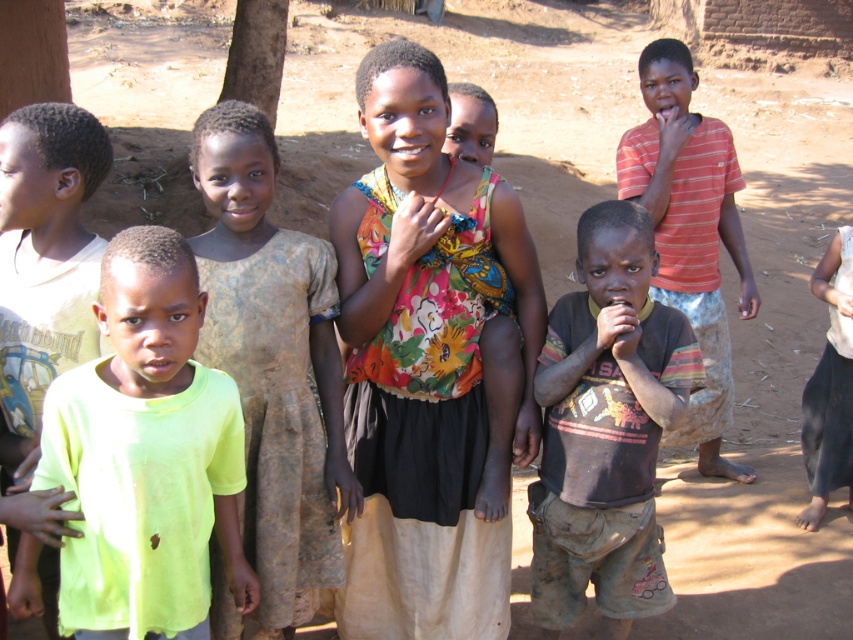
Can you confirm if neon yellow t-shirt at left is thinner than dirty brown shirt at center?

In fact, neon yellow t-shirt at left might be wider than dirty brown shirt at center.

How far apart are neon yellow t-shirt at left and dirty brown shirt at center?

The distance of neon yellow t-shirt at left from dirty brown shirt at center is 3.88 feet.

I want to click on neon yellow t-shirt at left, so click(x=157, y=451).

Locate an element on the screen. Image resolution: width=853 pixels, height=640 pixels. neon yellow t-shirt at left is located at coordinates (157, 451).

Between point (39, 161) and point (714, 248), which one is positioned in front?

Point (39, 161)

Is light green t-shirt at left below striped cotton shirt at right?

Yes, light green t-shirt at left is below striped cotton shirt at right.

Does point (18, 244) lie in front of point (747, 269)?

Yes.

Find the location of `light green t-shirt at left`. light green t-shirt at left is located at coordinates (44, 262).

Which is below, neon yellow t-shirt at left or striped cotton shirt at right?

neon yellow t-shirt at left is below.

Does neon yellow t-shirt at left have a larger size compared to striped cotton shirt at right?

No.

You are a GUI agent. You are given a task and a screenshot of the screen. Output one action in this format:
    pyautogui.click(x=<x>, y=<y>)
    Task: Click on the neon yellow t-shirt at left
    
    Given the screenshot: What is the action you would take?
    pyautogui.click(x=157, y=451)